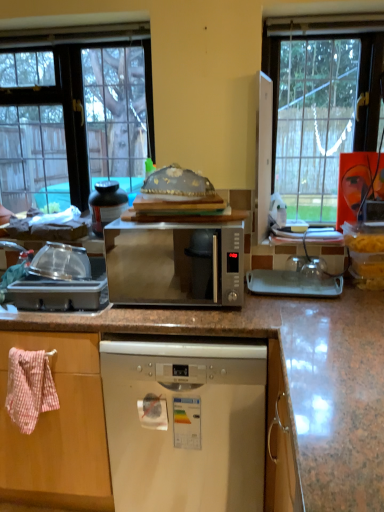
The image size is (384, 512). In order to click on vacant point above pink woven towel at left (from a real-world perspective) in this screenshot , I will do `click(25, 347)`.